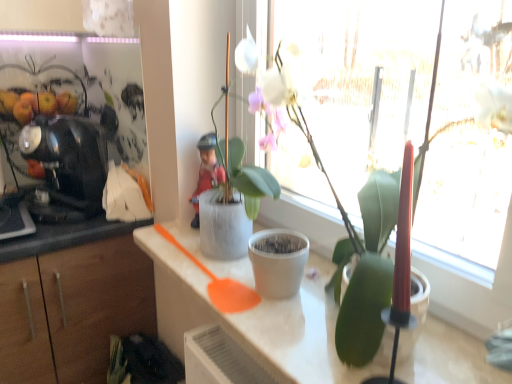
Locate an element on the screen. The width and height of the screenshot is (512, 384). vacant space in white matte pot at center, acting as the second houseplant starting from the back (from a real-world perspective) is located at coordinates (305, 327).